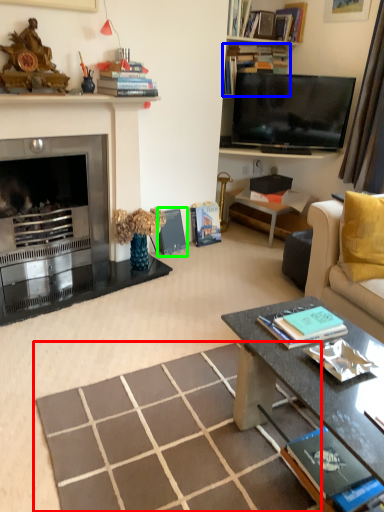
Question: Considering the real-world distances, which object is closest to square (highlighted by a red box)? book (highlighted by a blue box) or book (highlighted by a green box).

Choices:
 (A) book
 (B) book

Answer: (B)